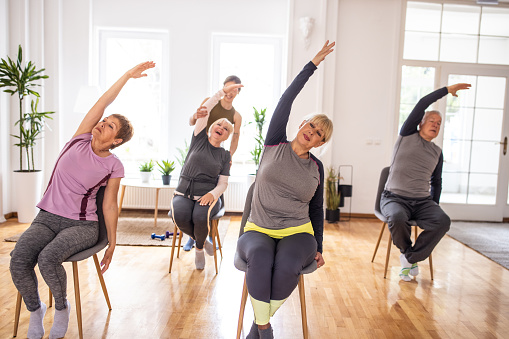
This screenshot has width=509, height=339. Identify the location of plant pots. (333, 212), (165, 178), (145, 178), (22, 188), (344, 186), (344, 206).